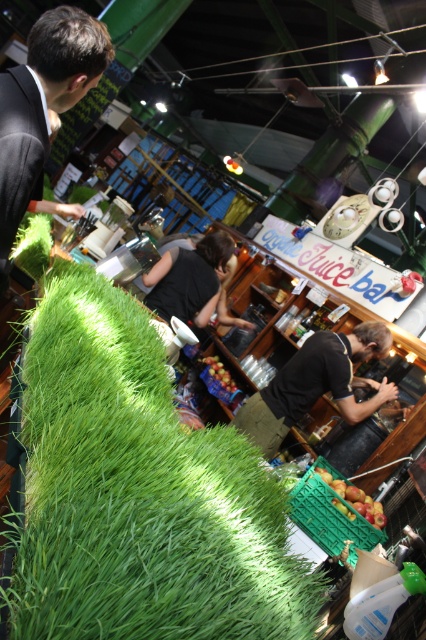
Between black fabric apron at center and shiny red apples at center, which one appears on the left side from the viewer's perspective?

shiny red apples at center is more to the left.

Is black fabric apron at center to the right of shiny red apples at center from the viewer's perspective?

Yes, black fabric apron at center is to the right of shiny red apples at center.

Does point (350, 390) come farther from viewer compared to point (212, 372)?

No, (350, 390) is closer to viewer.

I want to click on black fabric apron at center, so click(x=316, y=385).

Who is more forward, (14, 109) or (350, 401)?

Point (14, 109)

Which is more to the left, dark suit at left or black fabric apron at center?

dark suit at left is more to the left.

Which is in front, point (77, 12) or point (373, 387)?

Point (77, 12) is more forward.

The image size is (426, 640). What are the coordinates of `dark suit at left` in the screenshot? It's located at point(43,106).

Is point (46, 577) less distant than point (219, 381)?

Yes, point (46, 577) is closer to viewer.

Can you confirm if green grassy cushion at lower left is positioned to the right of shiny red apples at center?

In fact, green grassy cushion at lower left is to the left of shiny red apples at center.

Is point (123, 512) behind point (218, 381)?

No, it is not.

This screenshot has width=426, height=640. What are the coordinates of `green grassy cushion at lower left` in the screenshot? It's located at (140, 493).